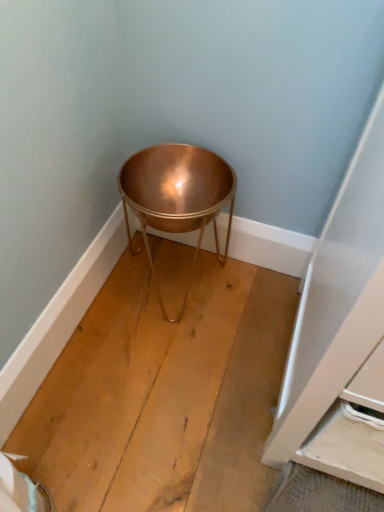
Identify the location of copper metallic bowl at center. The image size is (384, 512). (177, 196).

Measure the distance between copper metallic bowl at center and camera.

They are 33.83 inches apart.

Describe the element at coordinates (177, 196) in the screenshot. I see `copper metallic bowl at center` at that location.

Locate an element on the screen. The height and width of the screenshot is (512, 384). copper metallic bowl at center is located at coordinates (177, 196).